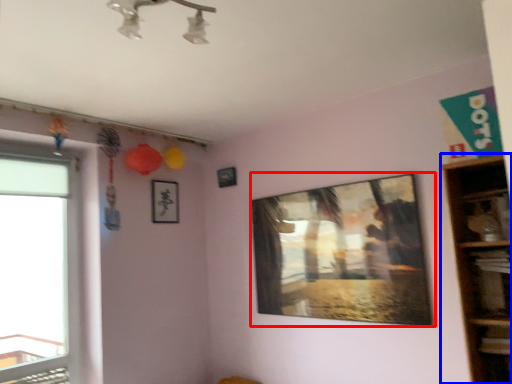
Question: Among these objects, which one is nearest to the camera, picture frame (highlighted by a red box) or shelf (highlighted by a blue box)?

Choices:
 (A) picture frame
 (B) shelf

Answer: (B)